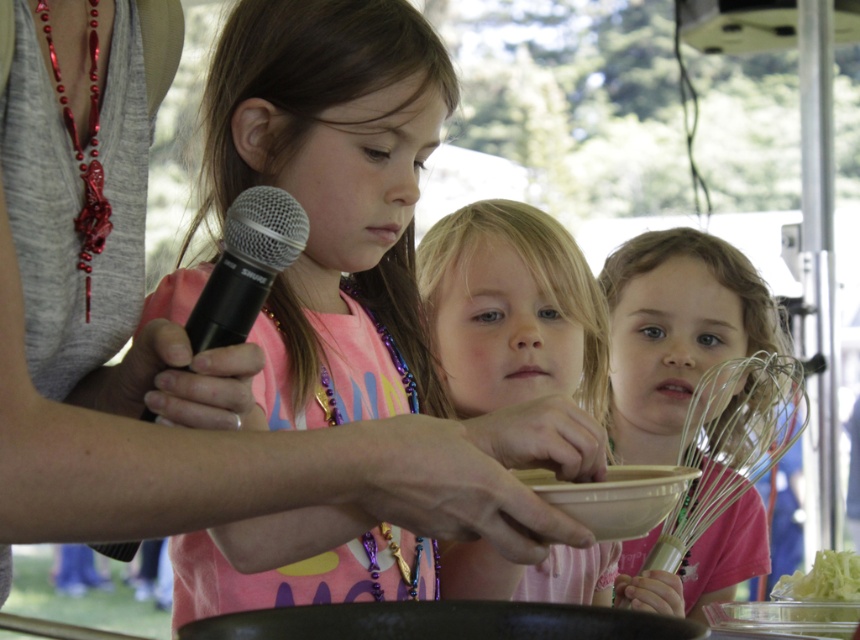
Question: Is the position of black plastic microphone at upper center more distant than that of white matte bowl at center?

Choices:
 (A) no
 (B) yes

Answer: (A)

Question: Is metallic silver whisk at lower right further to camera compared to black matte frying pan at center?

Choices:
 (A) no
 (B) yes

Answer: (B)

Question: Which point appears farthest from the camera in this image?

Choices:
 (A) (256, 272)
 (B) (413, 618)

Answer: (A)

Question: Does metallic silver whisk at lower right appear under white matte bowl at center?

Choices:
 (A) yes
 (B) no

Answer: (A)

Question: Which object is farther from the camera taking this photo?

Choices:
 (A) white matte bowl at center
 (B) green leafy lettuce at lower right
 (C) black matte frying pan at center
 (D) black plastic microphone at upper center

Answer: (B)

Question: Which object is closer to the camera taking this photo?

Choices:
 (A) metallic silver whisk at lower right
 (B) black plastic microphone at upper center

Answer: (B)